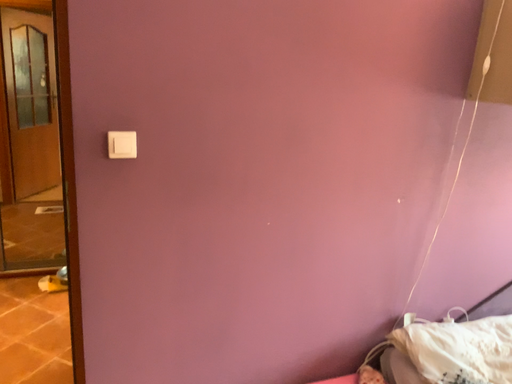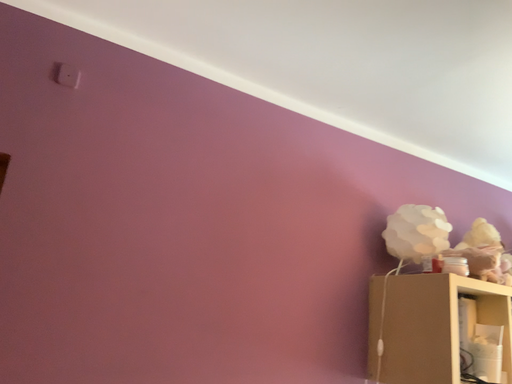
Question: How did the camera likely rotate when shooting the video?

Choices:
 (A) rotated left
 (B) rotated right

Answer: (B)